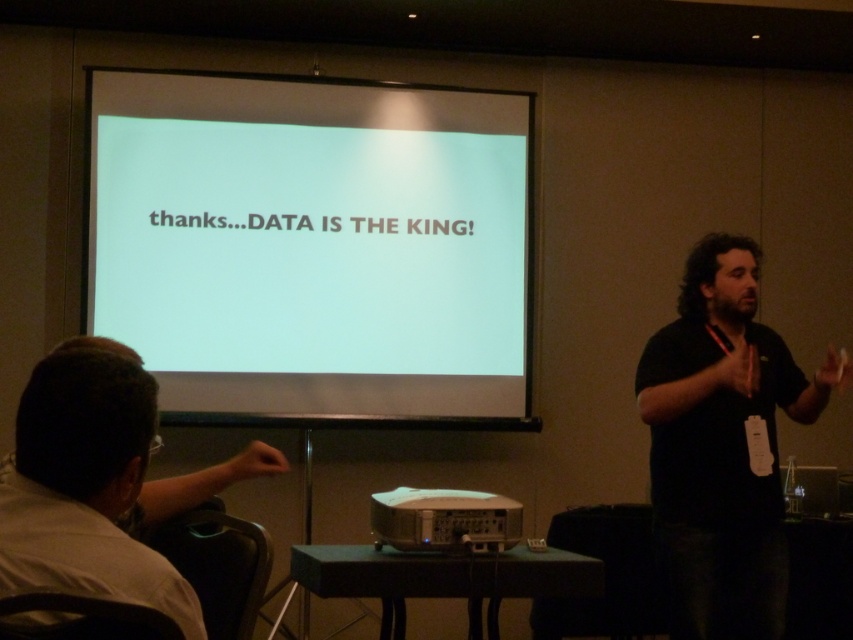
You are an attendee at the presentation and want to take a photo of the white matte projection screen at upper center. Based on your current position, can you estimate the coordinates of the screen to frame it properly?

The white matte projection screen at upper center is located at coordinates point (314,246).

You are organizing a presentation and need to ensure that the white matte projection screen at upper center and the black shirt at center are visible to all attendees. Based on their widths, which object should be placed closer to the front of the room to ensure better visibility?

The white matte projection screen at upper center should be placed closer to the front of the room because it is wider than the black shirt at center, making it easier to see from a distance.